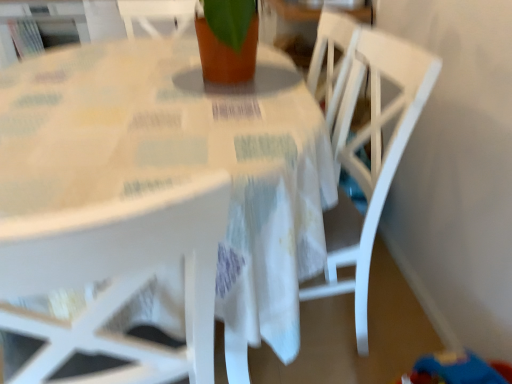
Question: Is white fabric table at center not inside white wood chair at center?

Choices:
 (A) yes
 (B) no

Answer: (A)

Question: Is white fabric table at center aimed at white wood chair at center?

Choices:
 (A) no
 (B) yes

Answer: (B)

Question: Is white fabric table at center at the right side of white wood chair at center?

Choices:
 (A) no
 (B) yes

Answer: (A)

Question: Is white fabric table at center looking in the opposite direction of white wood chair at center?

Choices:
 (A) yes
 (B) no

Answer: (A)

Question: From the image's perspective, is white fabric table at center on top of white wood chair at center?

Choices:
 (A) no
 (B) yes

Answer: (B)

Question: Is white fabric table at center to the left of white wood chair at center from the viewer's perspective?

Choices:
 (A) yes
 (B) no

Answer: (A)

Question: From the image's perspective, is white wood chair at center on top of white fabric table at center?

Choices:
 (A) no
 (B) yes

Answer: (A)

Question: Does white wood chair at center have a greater height compared to white fabric table at center?

Choices:
 (A) yes
 (B) no

Answer: (A)

Question: Can you confirm if white wood chair at center is wider than white fabric table at center?

Choices:
 (A) yes
 (B) no

Answer: (B)

Question: Is white fabric table at center surrounded by white wood chair at center?

Choices:
 (A) no
 (B) yes

Answer: (A)

Question: From a real-world perspective, is white wood chair at center positioned over white fabric table at center based on gravity?

Choices:
 (A) no
 (B) yes

Answer: (B)

Question: Are white wood chair at center and white fabric table at center beside each other?

Choices:
 (A) no
 (B) yes

Answer: (A)

Question: Considering their positions, is white fabric table at center located in front of or behind white wood chair at center?

Choices:
 (A) front
 (B) behind

Answer: (A)